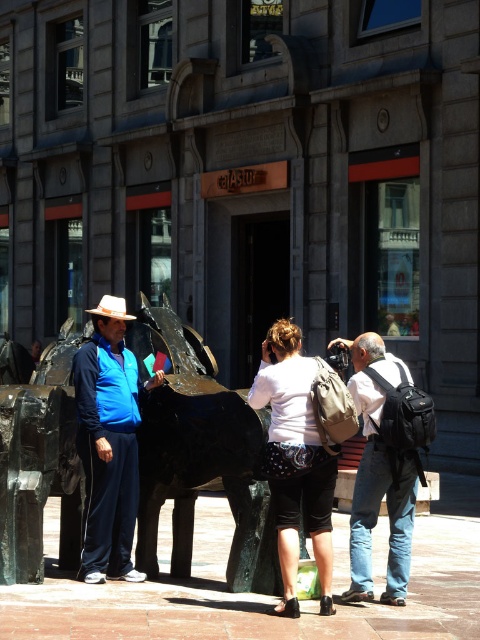
Question: Is green polished stone sculpture at center further to camera compared to matte black backpack at center?

Choices:
 (A) no
 (B) yes

Answer: (B)

Question: Does green polished stone sculpture at center appear on the right side of white matte backpack at center?

Choices:
 (A) yes
 (B) no

Answer: (B)

Question: Is green polished stone sculpture at center in front of blue fabric jacket at left?

Choices:
 (A) yes
 (B) no

Answer: (A)

Question: Estimate the real-world distances between objects in this image. Which object is farther from the green polished stone sculpture at center?

Choices:
 (A) blue fabric jacket at left
 (B) matte black backpack at center
 (C) white matte backpack at center

Answer: (B)

Question: Estimate the real-world distances between objects in this image. Which object is closer to the matte black backpack at center?

Choices:
 (A) blue fabric jacket at left
 (B) green polished stone sculpture at center
 (C) white matte backpack at center

Answer: (C)

Question: Estimate the real-world distances between objects in this image. Which object is farther from the white matte backpack at center?

Choices:
 (A) matte black backpack at center
 (B) blue fabric jacket at left
 (C) green polished stone sculpture at center

Answer: (B)